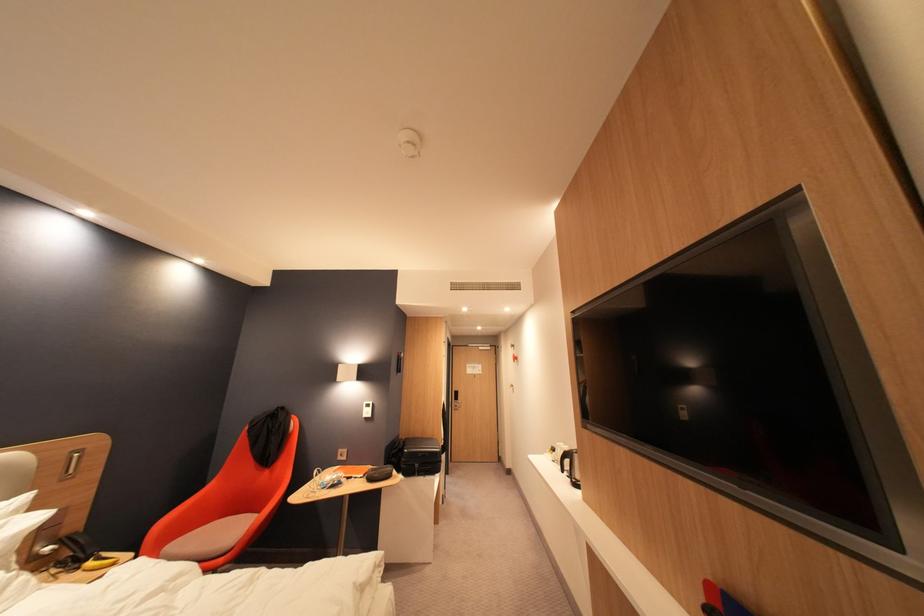
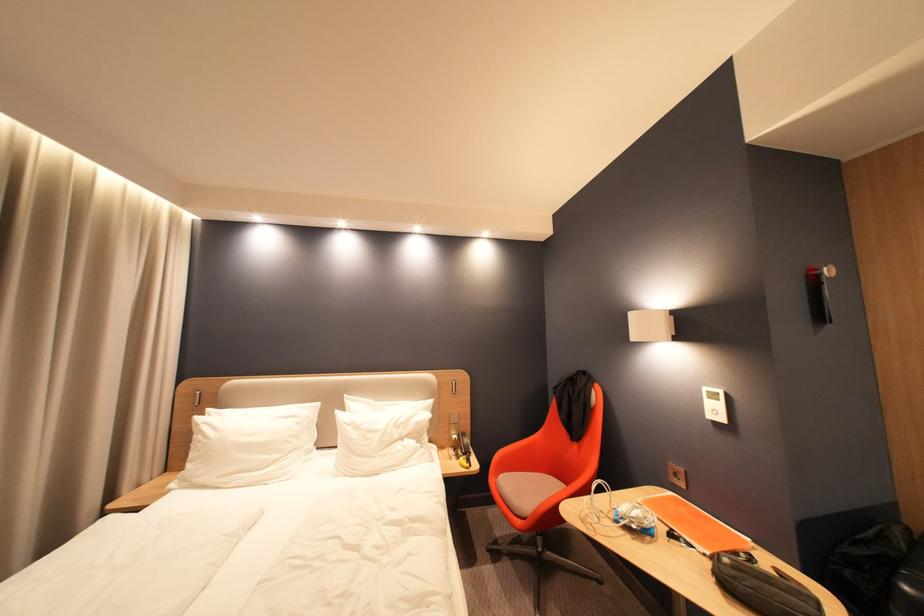
Find the pixel in the second image that matches the point at 410,355 in the first image.

(830, 270)